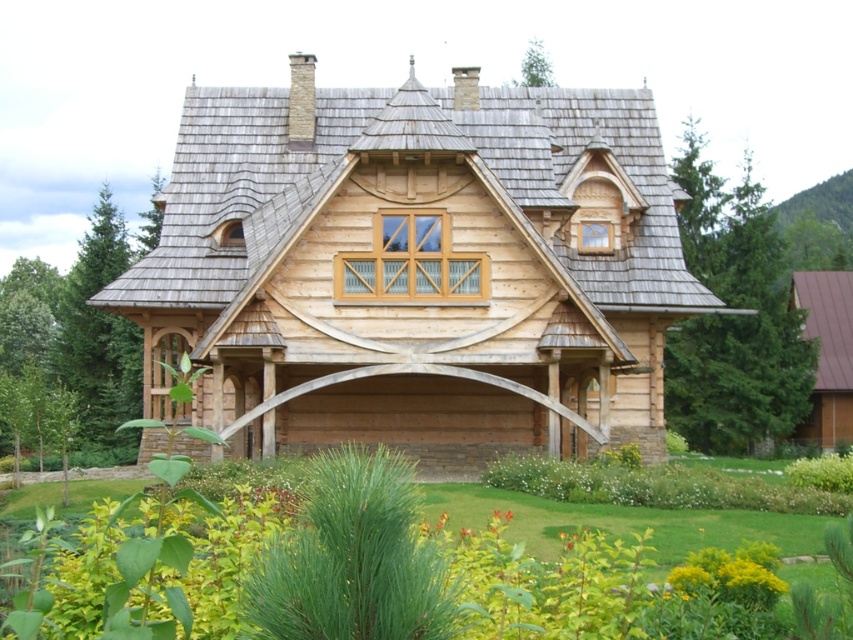
Question: Observing the image, what is the correct spatial positioning of metallic brown roof at right in reference to yellow-green foliage at lower center?

Choices:
 (A) above
 (B) below

Answer: (A)

Question: Which object is farther from the camera taking this photo?

Choices:
 (A) metallic brown roof at right
 (B) yellow-green foliage at lower center
 (C) green leafy plants at lower center
 (D) natural wood cottage at center

Answer: (A)

Question: Estimate the real-world distances between objects in this image. Which object is closer to the natural wood cottage at center?

Choices:
 (A) metallic brown roof at right
 (B) yellow-green foliage at lower center

Answer: (B)

Question: Estimate the real-world distances between objects in this image. Which object is farther from the natural wood cottage at center?

Choices:
 (A) metallic brown roof at right
 (B) yellow-green foliage at lower center

Answer: (A)

Question: Is natural wood cottage at center positioned before green leafy plants at lower center?

Choices:
 (A) yes
 (B) no

Answer: (B)

Question: Is green leafy plants at lower center to the left of yellow-green foliage at lower center from the viewer's perspective?

Choices:
 (A) yes
 (B) no

Answer: (A)